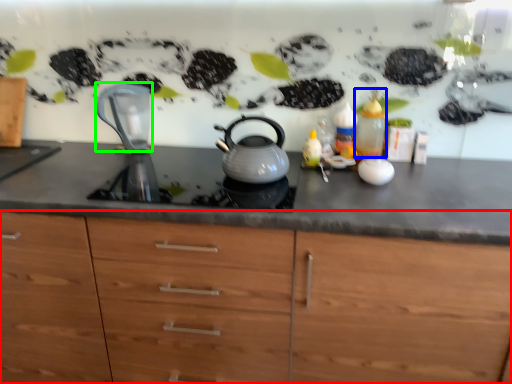
Question: Which object is the closest to the cabinetry (highlighted by a red box)? Choose among these: bottle (highlighted by a blue box) or jug (highlighted by a green box).

Choices:
 (A) bottle
 (B) jug

Answer: (A)